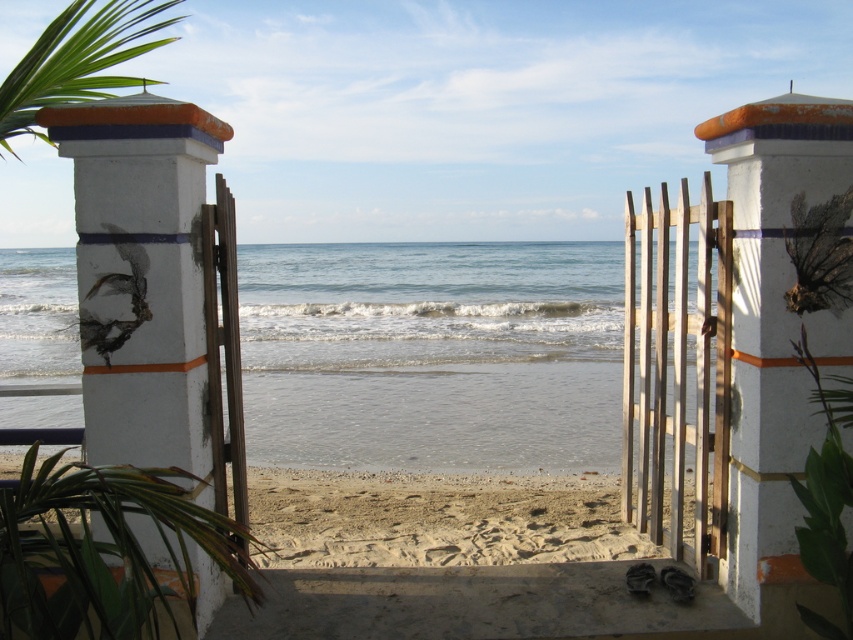
Does white painted concrete pillar at right have a larger size compared to beige sandy beach at center?

Incorrect, white painted concrete pillar at right is not larger than beige sandy beach at center.

Is white painted concrete pillar at right wider than beige sandy beach at center?

In fact, white painted concrete pillar at right might be narrower than beige sandy beach at center.

Is point (795, 268) farther from viewer compared to point (479, 490)?

No, it is in front of (479, 490).

This screenshot has height=640, width=853. What are the coordinates of `white painted concrete pillar at right` in the screenshot? It's located at (781, 328).

Can you confirm if white painted concrete pillar at left is wider than green leafy palm at upper left?

No, white painted concrete pillar at left is not wider than green leafy palm at upper left.

Is white painted concrete pillar at left above green leafy palm at upper left?

No, white painted concrete pillar at left is not above green leafy palm at upper left.

Locate an element on the screen. The width and height of the screenshot is (853, 640). white painted concrete pillar at left is located at coordinates (142, 275).

Which is above, white painted concrete pillar at right or white painted concrete pillar at left?

white painted concrete pillar at left is above.

Is white painted concrete pillar at right wider than white painted concrete pillar at left?

No, white painted concrete pillar at right is not wider than white painted concrete pillar at left.

You are a GUI agent. You are given a task and a screenshot of the screen. Output one action in this format:
    pyautogui.click(x=<x>, y=<y>)
    Task: Click on the white painted concrete pillar at right
    
    Given the screenshot: What is the action you would take?
    [x=781, y=328]